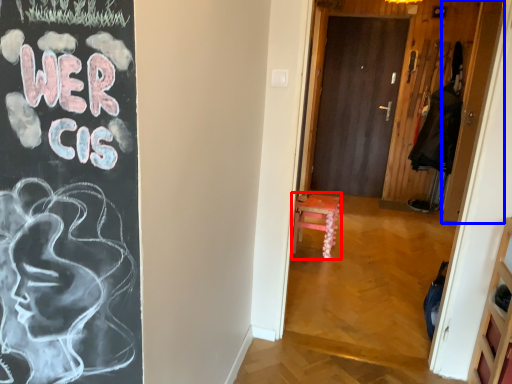
Question: Which point is closer to the camera, furniture (highlighted by a red box) or door (highlighted by a blue box)?

Choices:
 (A) furniture
 (B) door

Answer: (A)